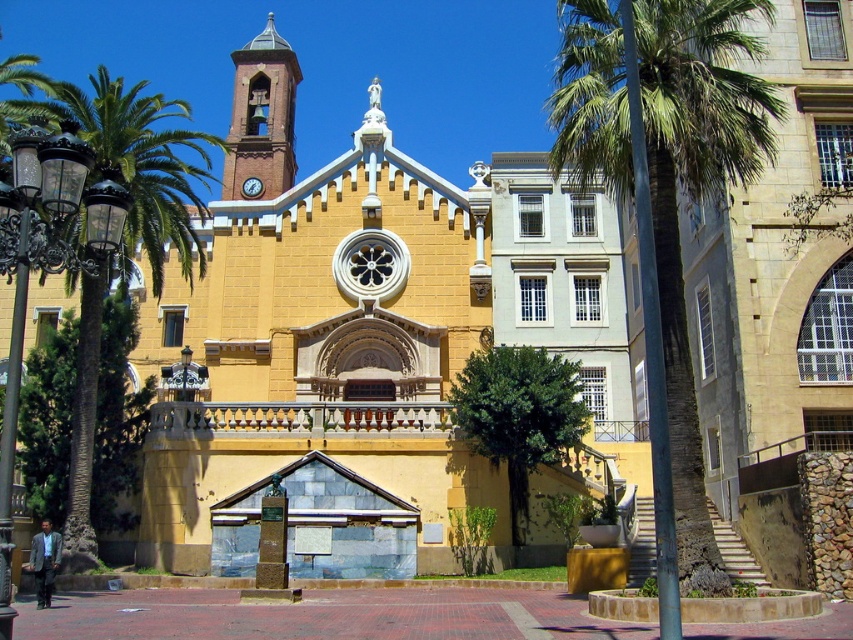
You are a drone operator tasked with capturing aerial footage of the yellow church with its bell tower. Your drone has a maximum flight range of 35 meters from your current position. You need to fly the drone to the green leafy palm tree at right to get a shot of the brick stonework bell tower at upper center in the background. Can the drone reach the palm tree and still keep the bell tower within its filming range?

The green leafy palm tree at right and brick stonework bell tower at upper center are 36.28 meters apart. Since the drone can only fly up to 35 meters, it cannot reach the palm tree while keeping the bell tower within its 35 meter filming range.

You are standing at the center of the red brick pavement in front of the yellow church with a bell tower. You want to walk straight towards the bell tower. Will you pass by the green leafy palm tree at right before reaching the bell tower?

The green leafy palm tree at right is located at coordinates point [695,200], which is to the right side of the scene. Since you are walking straight towards the bell tower from the center, you will not pass by the green leafy palm tree at right before reaching the bell tower as it is positioned to the side rather than along your path.